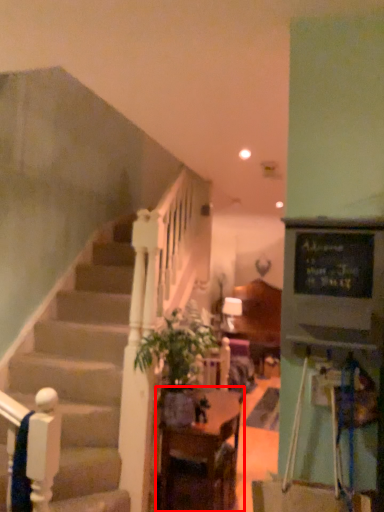
Question: Considering the relative positions of table (annotated by the red box) and houseplant in the image provided, where is table (annotated by the red box) located with respect to the staircase?

Choices:
 (A) right
 (B) left

Answer: (A)